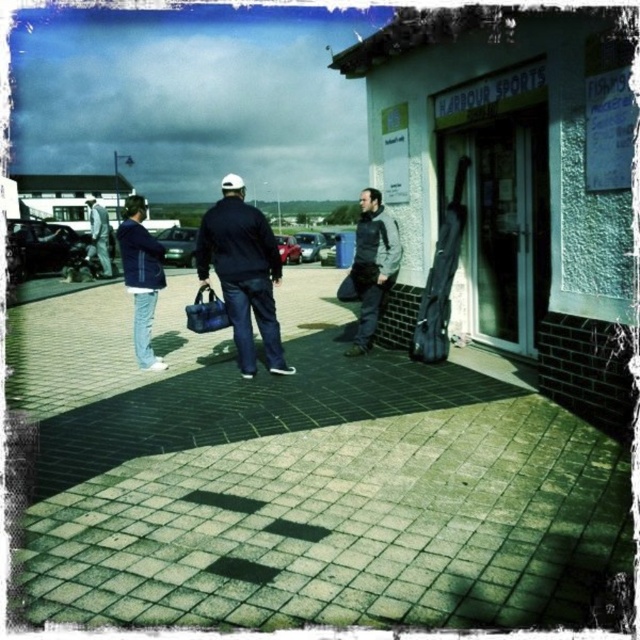
Question: Which is farther from the dark gray jacket at center?

Choices:
 (A) blue denim jacket at left
 (B) blue fabric bag at center
 (C) matte blue jacket at left
 (D) green brick pavement at center

Answer: (C)

Question: Can you confirm if green brick pavement at center is positioned below matte blue jacket at left?

Choices:
 (A) no
 (B) yes

Answer: (B)

Question: From the image, what is the correct spatial relationship of dark gray jacket at center in relation to blue denim jacket at left?

Choices:
 (A) below
 (B) above

Answer: (B)

Question: Which is nearer to the matte blue bag at center?

Choices:
 (A) blue fabric bag at center
 (B) blue denim jacket at left
 (C) matte blue jacket at left

Answer: (A)

Question: Which point is farther to the camera?

Choices:
 (A) matte blue jacket at left
 (B) dark gray jacket at center

Answer: (A)

Question: Is green brick pavement at center below matte blue bag at center?

Choices:
 (A) no
 (B) yes

Answer: (B)